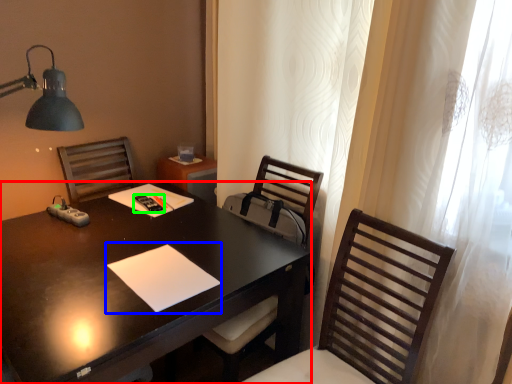
Question: Estimate the real-world distances between objects in this image. Which object is farther from desk (highlighted by a red box), notepad (highlighted by a blue box) or remote control (highlighted by a green box)?

Choices:
 (A) notepad
 (B) remote control

Answer: (B)